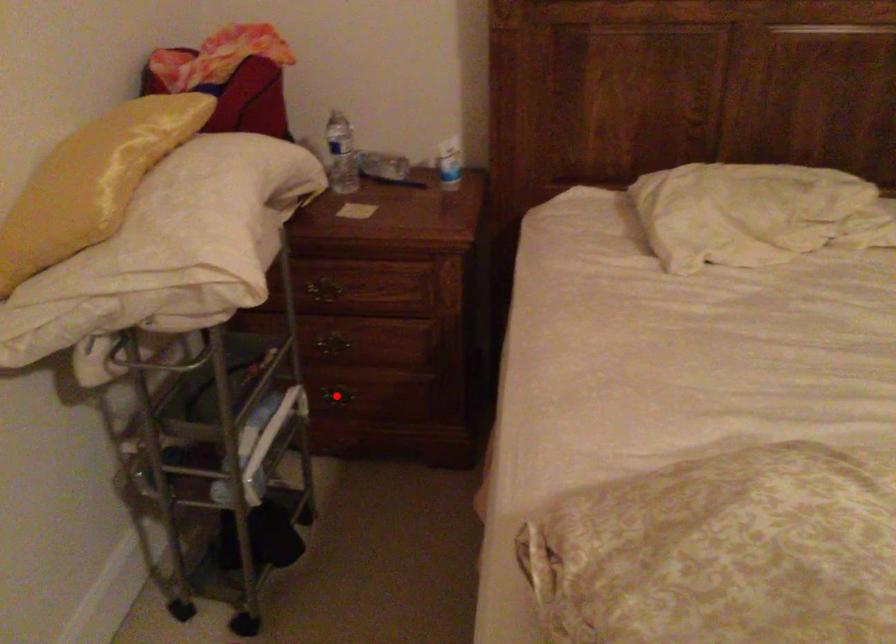
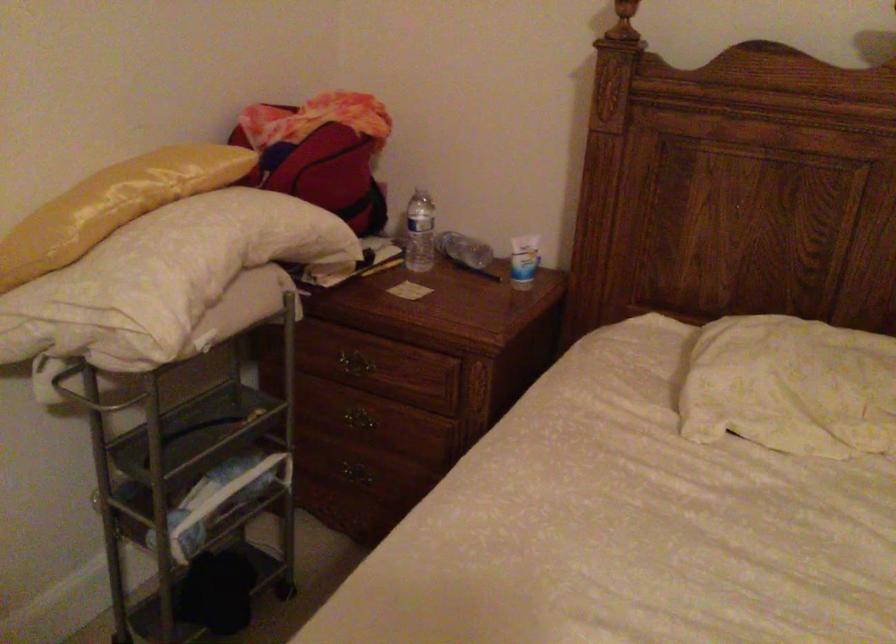
Find the pixel in the second image that matches the highlighted location in the first image.

(355, 473)